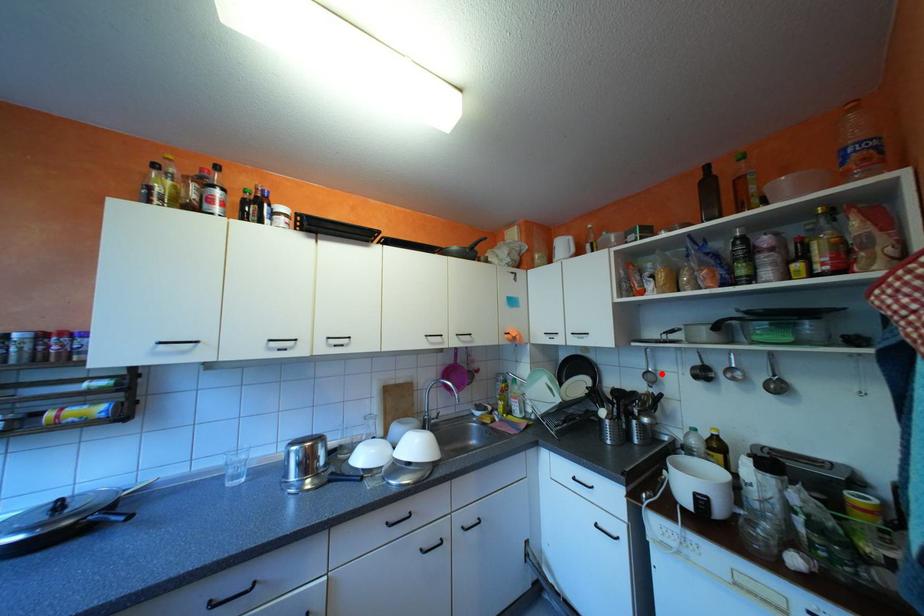
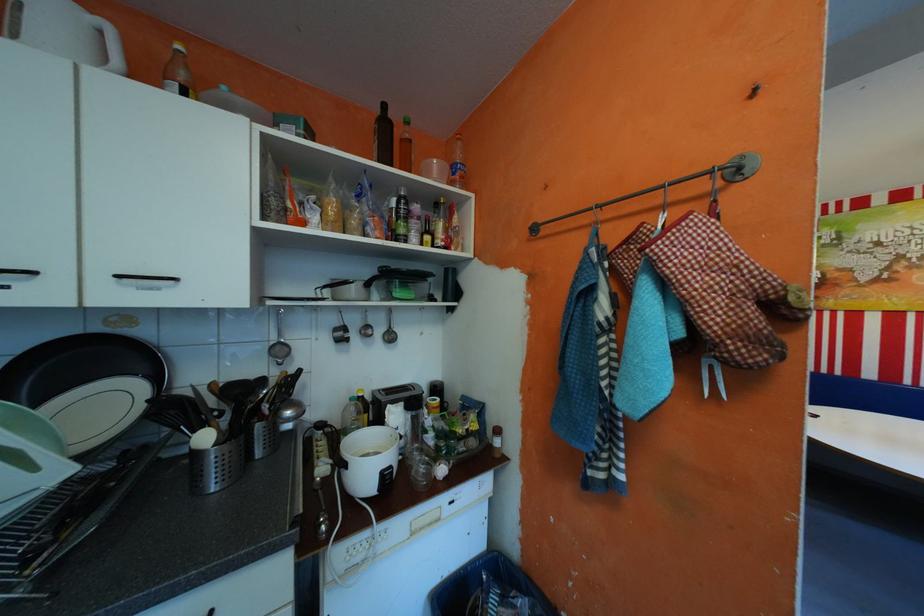
Locate, in the second image, the point that corresponds to the highlighted location in the first image.

(289, 346)